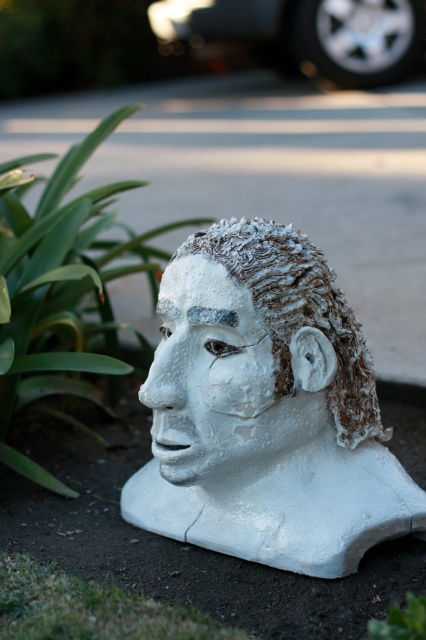
Can you confirm if green leafy plant at lower left is positioned below green leafy plant at lower right?

No.

Measure the distance from green leafy plant at lower left to green leafy plant at lower right.

green leafy plant at lower left and green leafy plant at lower right are 34.70 inches apart from each other.

At what (x,y) coordinates should I click in order to perform the action: click on green leafy plant at lower left. Please return your answer as a coordinate pair (x, y). Looking at the image, I should click on (63, 291).

Can you confirm if white frosted bust at center is positioned below green grass at lower left?

No.

Does white frosted bust at center have a larger size compared to green grass at lower left?

Yes.

Locate an element on the screen. The width and height of the screenshot is (426, 640). white frosted bust at center is located at coordinates (210, 376).

You are a GUI agent. You are given a task and a screenshot of the screen. Output one action in this format:
    pyautogui.click(x=<x>, y=<y>)
    Task: Click on the white frosted bust at center
    This screenshot has height=640, width=426.
    Given the screenshot: What is the action you would take?
    pyautogui.click(x=210, y=376)

Between green grass at lower left and green leafy plant at lower right, which one is positioned lower?

green grass at lower left is lower down.

Measure the distance between point (175, 618) and camera.

The distance of point (175, 618) from camera is 3.90 feet.

Is point (118, 636) farther from camera compared to point (394, 618)?

Yes.

Where is `green grass at lower left`? This screenshot has width=426, height=640. green grass at lower left is located at coordinates (89, 609).